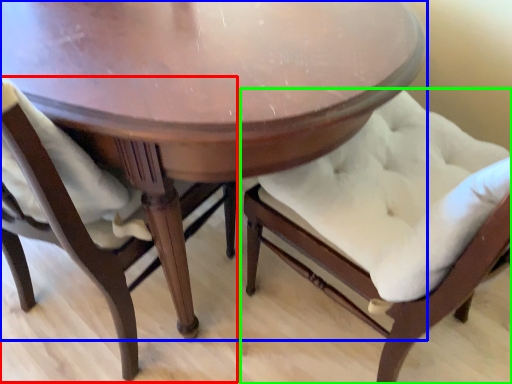
Question: Which is nearer to the chair (highlighted by a red box)? table (highlighted by a blue box) or chair (highlighted by a green box).

Choices:
 (A) table
 (B) chair

Answer: (A)